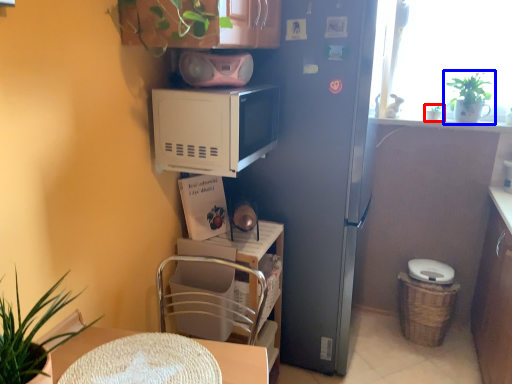
Question: Which object appears closest to the camera in this image, houseplant (highlighted by a red box) or houseplant (highlighted by a blue box)?

Choices:
 (A) houseplant
 (B) houseplant

Answer: (B)